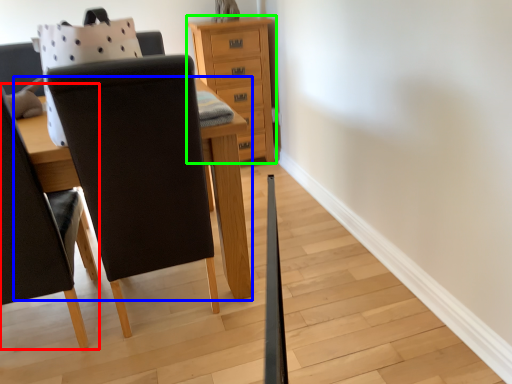
Question: Estimate the real-world distances between objects in this image. Which object is farther from chair (highlighted by a red box), table (highlighted by a blue box) or chest of drawers (highlighted by a green box)?

Choices:
 (A) table
 (B) chest of drawers

Answer: (B)